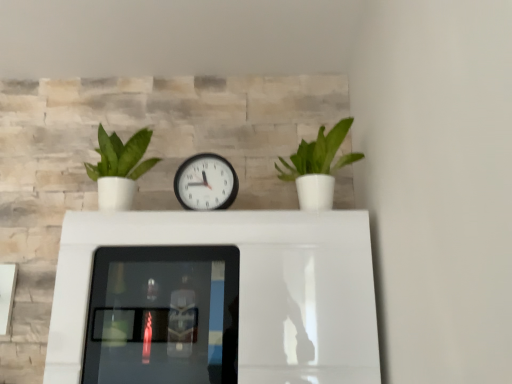
Question: From a real-world perspective, is white glossy table at center physically below white plastic wall clock at center?

Choices:
 (A) no
 (B) yes

Answer: (B)

Question: Does white glossy table at center appear on the right side of white plastic wall clock at center?

Choices:
 (A) no
 (B) yes

Answer: (B)

Question: Is white glossy table at center surrounding white plastic wall clock at center?

Choices:
 (A) yes
 (B) no

Answer: (B)

Question: Can you confirm if white glossy table at center is smaller than white plastic wall clock at center?

Choices:
 (A) no
 (B) yes

Answer: (A)

Question: From the image's perspective, is white glossy table at center beneath white plastic wall clock at center?

Choices:
 (A) yes
 (B) no

Answer: (A)

Question: Considering the relative sizes of white glossy table at center and white plastic wall clock at center in the image provided, is white glossy table at center taller than white plastic wall clock at center?

Choices:
 (A) yes
 (B) no

Answer: (A)

Question: Does green matte plant at right, which appears as the 1th houseplant when viewed from the right, have a lesser height compared to green matte plant at left, the second houseplant in the right-to-left sequence?

Choices:
 (A) no
 (B) yes

Answer: (A)

Question: From a real-world perspective, is green matte plant at right, the second houseplant when ordered from left to right, positioned under green matte plant at left, the second houseplant in the right-to-left sequence, based on gravity?

Choices:
 (A) no
 (B) yes

Answer: (B)

Question: Can you confirm if green matte plant at right, which appears as the 1th houseplant when viewed from the right, is positioned to the right of green matte plant at left, the second houseplant in the right-to-left sequence?

Choices:
 (A) yes
 (B) no

Answer: (A)

Question: Could you tell me if green matte plant at right, the second houseplant when ordered from left to right, is turned towards green matte plant at left, the second houseplant in the right-to-left sequence?

Choices:
 (A) no
 (B) yes

Answer: (A)

Question: Is green matte plant at left, the first houseplant from the left, completely or partially inside green matte plant at right, which appears as the 1th houseplant when viewed from the right?

Choices:
 (A) yes
 (B) no

Answer: (B)

Question: From the image's perspective, is green matte plant at right, the second houseplant when ordered from left to right, over green matte plant at left, the second houseplant in the right-to-left sequence?

Choices:
 (A) no
 (B) yes

Answer: (B)

Question: From the image's perspective, would you say green matte plant at right, the second houseplant when ordered from left to right, is positioned over white glossy table at center?

Choices:
 (A) yes
 (B) no

Answer: (A)